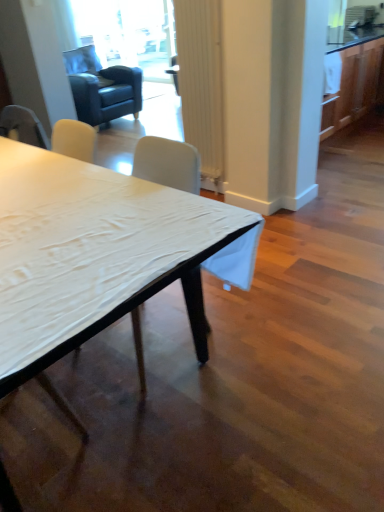
Question: Can you confirm if white fabric chair at center is shorter than white matte table at center?

Choices:
 (A) yes
 (B) no

Answer: (B)

Question: Considering the relative sizes of white fabric chair at center and white matte table at center in the image provided, is white fabric chair at center smaller than white matte table at center?

Choices:
 (A) no
 (B) yes

Answer: (B)

Question: From a real-world perspective, is white fabric chair at center below white matte table at center?

Choices:
 (A) yes
 (B) no

Answer: (B)

Question: Does white fabric chair at center have a greater width compared to white matte table at center?

Choices:
 (A) yes
 (B) no

Answer: (B)

Question: Considering the relative sizes of white fabric chair at center and white matte table at center in the image provided, is white fabric chair at center thinner than white matte table at center?

Choices:
 (A) no
 (B) yes

Answer: (B)

Question: Looking at the image, does dark blue leather swivel chair at upper left seem bigger or smaller compared to transparent glass door at upper center?

Choices:
 (A) big
 (B) small

Answer: (A)

Question: From the image's perspective, is dark blue leather swivel chair at upper left above or below transparent glass door at upper center?

Choices:
 (A) below
 (B) above

Answer: (A)

Question: Visually, is dark blue leather swivel chair at upper left positioned to the left or to the right of transparent glass door at upper center?

Choices:
 (A) right
 (B) left

Answer: (B)

Question: Relative to transparent glass door at upper center, is dark blue leather swivel chair at upper left in front or behind?

Choices:
 (A) behind
 (B) front

Answer: (B)

Question: Relative to dark blue leather swivel chair at upper left, is white ribbed curtain at center in front or behind?

Choices:
 (A) behind
 (B) front

Answer: (B)

Question: Does point (185, 73) appear closer or farther from the camera than point (124, 70)?

Choices:
 (A) closer
 (B) farther

Answer: (A)

Question: Considering the positions of white ribbed curtain at center and dark blue leather swivel chair at upper left in the image, is white ribbed curtain at center taller or shorter than dark blue leather swivel chair at upper left?

Choices:
 (A) tall
 (B) short

Answer: (B)

Question: From the image's perspective, relative to dark blue leather swivel chair at upper left, is white ribbed curtain at center above or below?

Choices:
 (A) above
 (B) below

Answer: (B)

Question: From a real-world perspective, is white ribbed curtain at center above or below white matte table at center?

Choices:
 (A) below
 (B) above

Answer: (B)

Question: Do you think white ribbed curtain at center is within white matte table at center, or outside of it?

Choices:
 (A) inside
 (B) outside

Answer: (B)